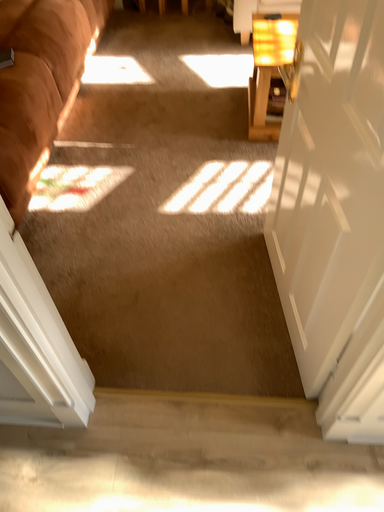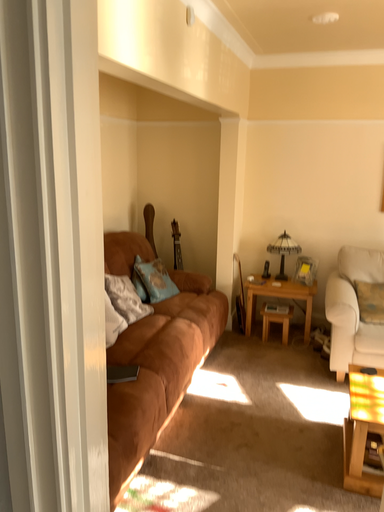
Question: Which way did the camera rotate in the video?

Choices:
 (A) rotated downward
 (B) rotated upward

Answer: (B)